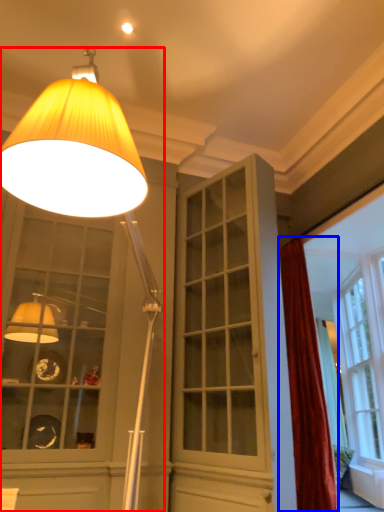
Question: Which point is further to the camera, lamp (highlighted by a red box) or curtain (highlighted by a blue box)?

Choices:
 (A) lamp
 (B) curtain

Answer: (B)